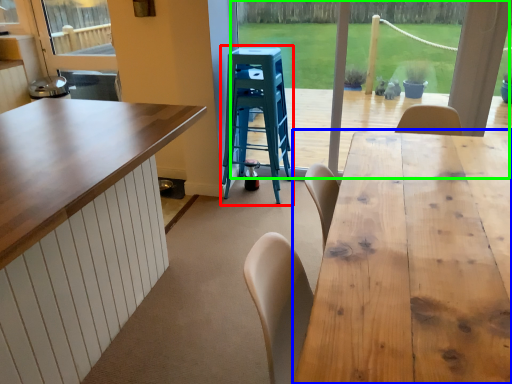
Question: Which object is the farthest from step stool (highlighted by a red box)? Choose among these: table (highlighted by a blue box) or window frame (highlighted by a green box).

Choices:
 (A) table
 (B) window frame

Answer: (B)